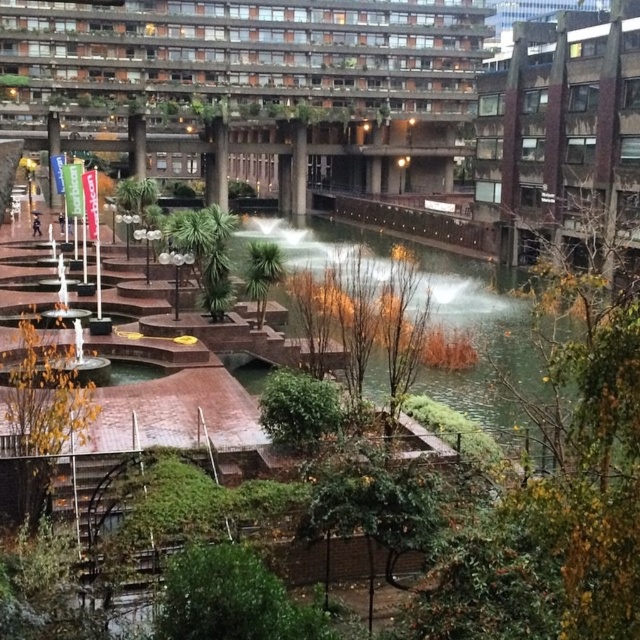
Who is positioned more to the left, concrete fountain at left or brown concrete building at upper right?

concrete fountain at left is more to the left.

Who is taller, concrete fountain at left or brown concrete building at upper right?

concrete fountain at left

The image size is (640, 640). What are the coordinates of `concrete fountain at left` in the screenshot? It's located at (353, 102).